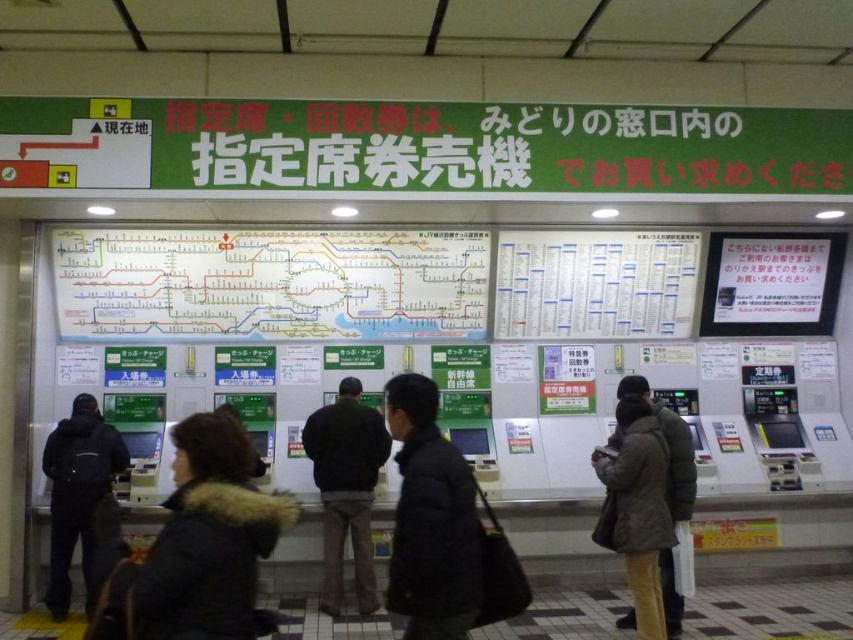
You are standing at the train station and need to locate two points marked on the floor. The first point is at coordinates point (399, 531) and the second is at point (637, 492). Which point is closer to you?

Point (399, 531) is closer to the viewer than point (637, 492).